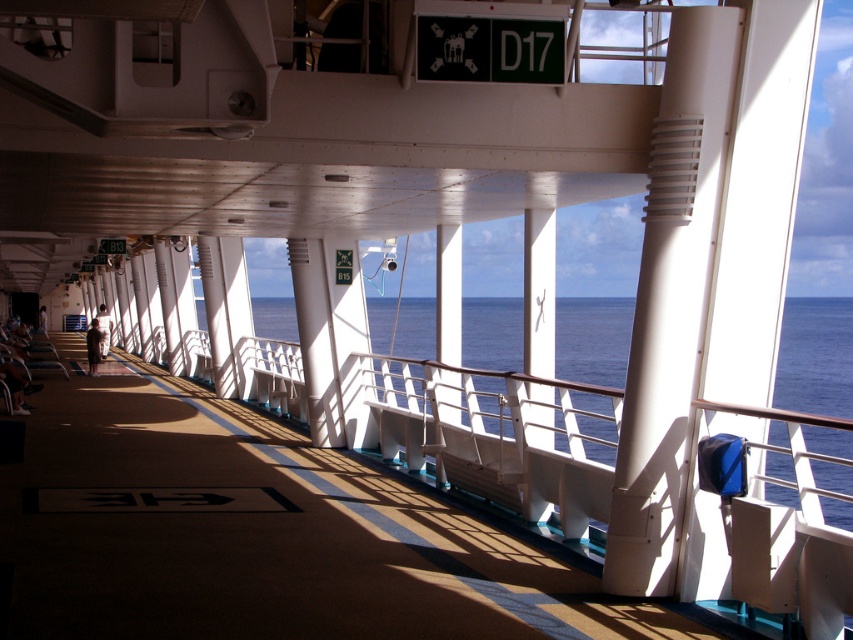
Question: Can you confirm if brown carpet at center is wider than blue water at center?

Choices:
 (A) yes
 (B) no

Answer: (B)

Question: Estimate the real-world distances between objects in this image. Which object is farther from the brown carpet at center?

Choices:
 (A) white fabric person at center
 (B) blue water at center

Answer: (A)

Question: Which of the following is the closest to the observer?

Choices:
 (A) (117, 554)
 (B) (90, 349)
 (C) (825, 403)

Answer: (A)

Question: Which object is closer to the camera taking this photo?

Choices:
 (A) dark brown leather jacket at left
 (B) white fabric person at center
 (C) blue water at center

Answer: (C)

Question: Where is brown carpet at center located in relation to blue water at center in the image?

Choices:
 (A) right
 (B) left

Answer: (B)

Question: Is brown carpet at center bigger than white fabric person at center?

Choices:
 (A) yes
 (B) no

Answer: (B)